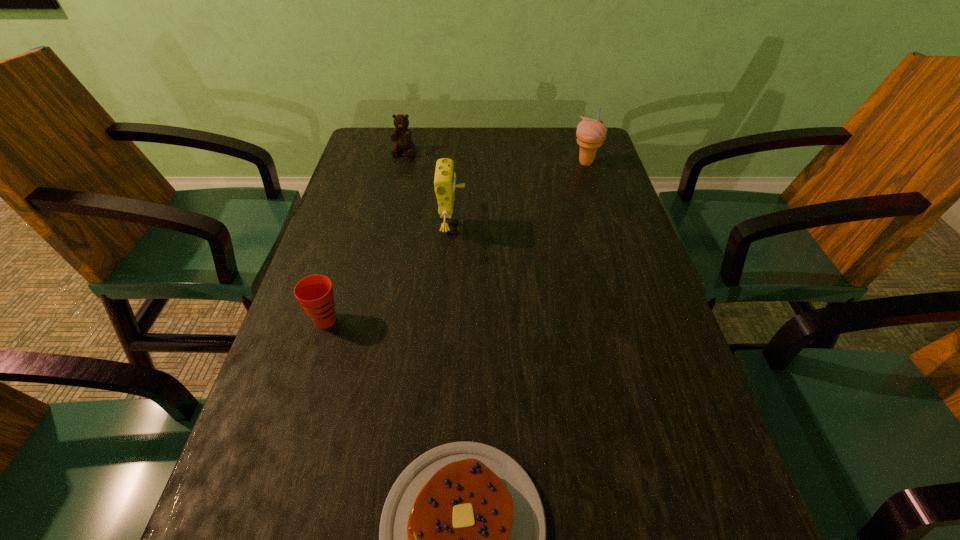
I want to click on free spot at the far right corner of the desktop, so click(604, 167).

Find the location of a particular element. The width and height of the screenshot is (960, 540). free space between the rightmost object and the third farthest object is located at coordinates (519, 195).

At what (x,y) coordinates should I click in order to perform the action: click on vacant point located between the rightmost object and the second object from left to right. Please return your answer as a coordinate pair (x, y). Looking at the image, I should click on pos(495,157).

You are a GUI agent. You are given a task and a screenshot of the screen. Output one action in this format:
    pyautogui.click(x=<x>, y=<y>)
    Task: Click on the empty space between the third farthest object and the cup
    The height and width of the screenshot is (540, 960).
    Given the screenshot: What is the action you would take?
    pyautogui.click(x=390, y=274)

Identify the location of free space between the teddy bear and the third nearest object. This screenshot has width=960, height=540. (429, 190).

Where is `object that ranks as the third closest to the rightmost object`? The width and height of the screenshot is (960, 540). object that ranks as the third closest to the rightmost object is located at coordinates (314, 293).

The width and height of the screenshot is (960, 540). Find the location of `object that can be found as the closest to the third nearest object`. object that can be found as the closest to the third nearest object is located at coordinates (314, 293).

At what (x,y) coordinates should I click in order to perform the action: click on vacant area in the image that satisfies the following two spatial constraints: 1. on the face of the icecream; 2. on the left side of the second object from left to right. Please return your answer as a coordinate pair (x, y). Looking at the image, I should click on (402, 163).

The width and height of the screenshot is (960, 540). In order to click on free space that satisfies the following two spatial constraints: 1. on the face of the fourth object from right to left; 2. on the right side of the rightmost object in this screenshot , I will do `click(402, 163)`.